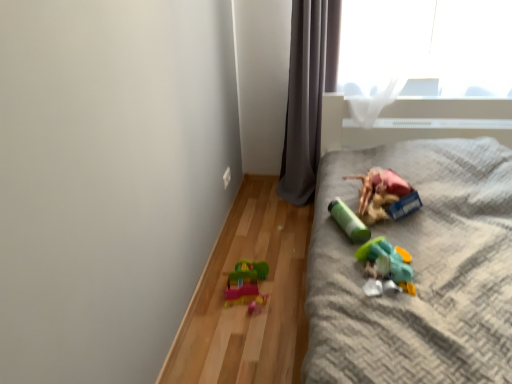
What are the coordinates of `vacant space that's between gray fabric curtain at upper center and translucent plastic toy at lower left, the 1th toy viewed from the left` in the screenshot? It's located at (278, 235).